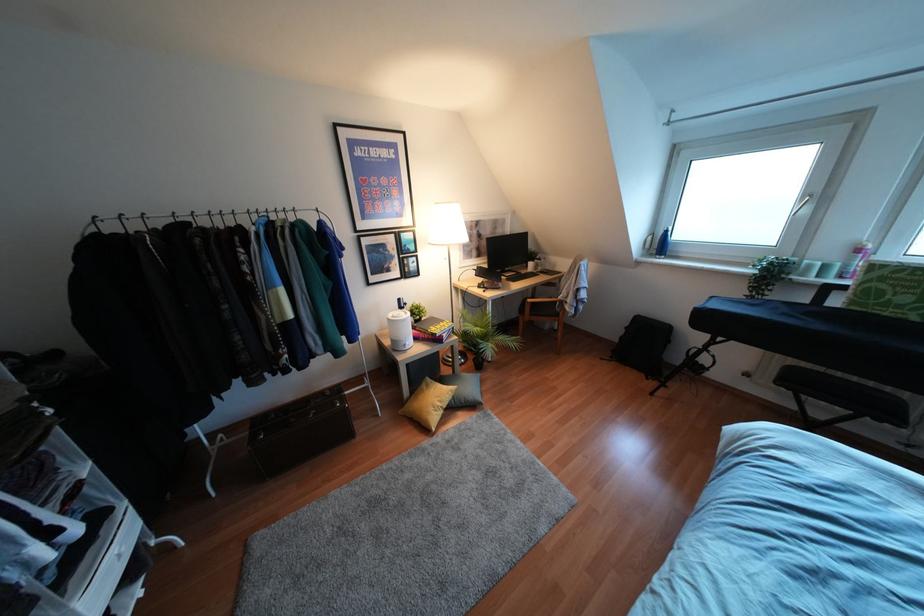
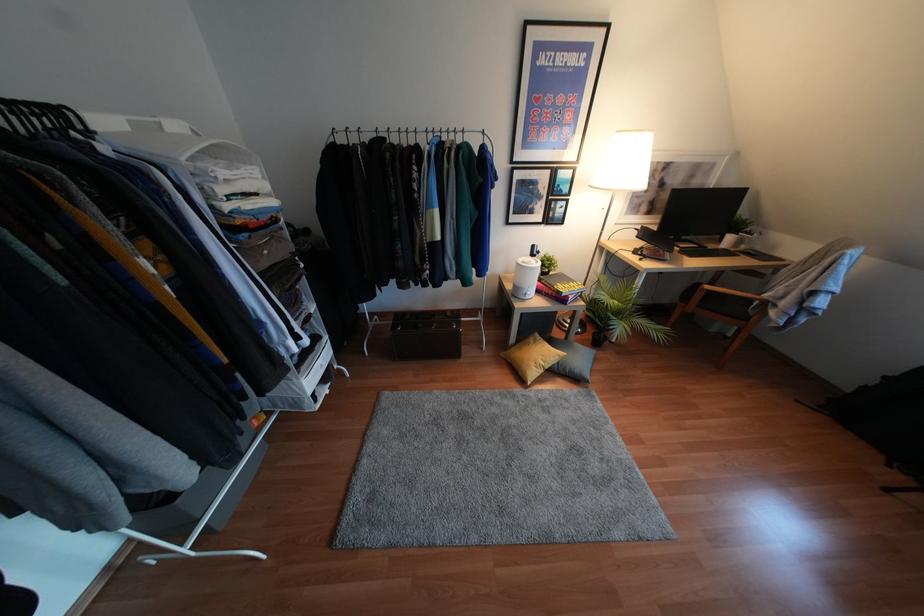
Question: The camera is either moving clockwise (left) or counter-clockwise (right) around the object. The first image is from the beginning of the video and the second image is from the end. Is the camera moving left or right when shooting the video?

Choices:
 (A) Left
 (B) Right

Answer: (B)